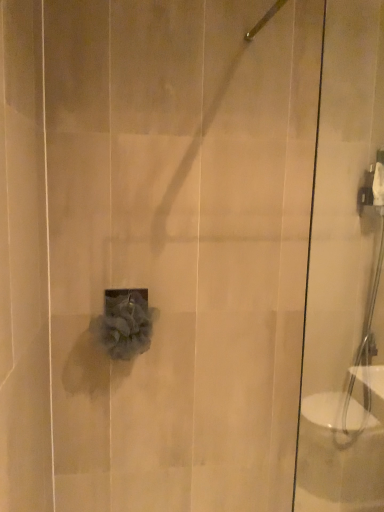
Question: Is gray fluffy loofah at center looking in the opposite direction of transparent glass shower door at right?

Choices:
 (A) no
 (B) yes

Answer: (A)

Question: Does gray fluffy loofah at center have a lesser width compared to transparent glass shower door at right?

Choices:
 (A) no
 (B) yes

Answer: (B)

Question: Could transparent glass shower door at right be considered to be inside gray fluffy loofah at center?

Choices:
 (A) no
 (B) yes

Answer: (A)

Question: Considering the relative sizes of gray fluffy loofah at center and transparent glass shower door at right in the image provided, is gray fluffy loofah at center wider than transparent glass shower door at right?

Choices:
 (A) no
 (B) yes

Answer: (A)

Question: Can you confirm if gray fluffy loofah at center is smaller than transparent glass shower door at right?

Choices:
 (A) no
 (B) yes

Answer: (B)

Question: Is gray fluffy loofah at center far away from transparent glass shower door at right?

Choices:
 (A) yes
 (B) no

Answer: (B)

Question: Is gray fluffy loofah at center completely or partially outside of satin nickel showerhead at upper center?

Choices:
 (A) no
 (B) yes

Answer: (B)

Question: From a real-world perspective, is gray fluffy loofah at center beneath satin nickel showerhead at upper center?

Choices:
 (A) yes
 (B) no

Answer: (A)

Question: Is gray fluffy loofah at center far away from satin nickel showerhead at upper center?

Choices:
 (A) yes
 (B) no

Answer: (B)

Question: Considering the relative sizes of gray fluffy loofah at center and satin nickel showerhead at upper center in the image provided, is gray fluffy loofah at center bigger than satin nickel showerhead at upper center?

Choices:
 (A) no
 (B) yes

Answer: (B)

Question: Considering the relative positions of gray fluffy loofah at center and satin nickel showerhead at upper center in the image provided, is gray fluffy loofah at center in front of satin nickel showerhead at upper center?

Choices:
 (A) yes
 (B) no

Answer: (B)

Question: Considering the relative sizes of gray fluffy loofah at center and satin nickel showerhead at upper center in the image provided, is gray fluffy loofah at center wider than satin nickel showerhead at upper center?

Choices:
 (A) yes
 (B) no

Answer: (B)

Question: Is there a large distance between transparent glass shower door at right and satin nickel showerhead at upper center?

Choices:
 (A) no
 (B) yes

Answer: (A)